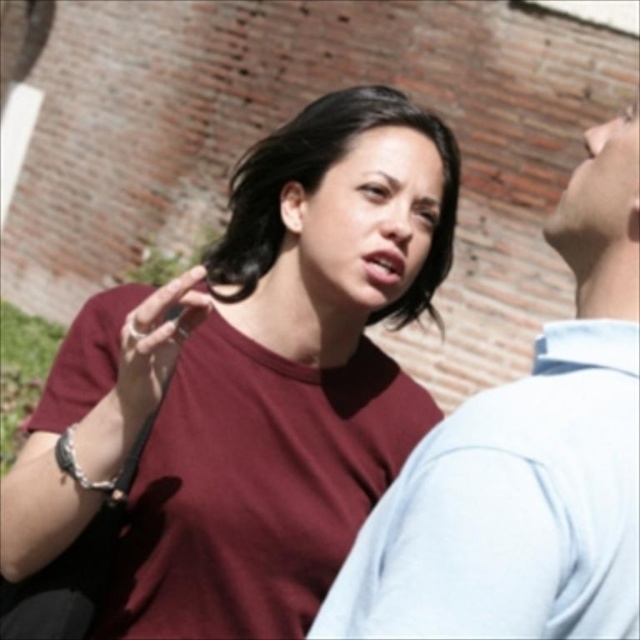
Is maroon cotton t-shirt at center to the left of light blue cotton shirt at upper right from the viewer's perspective?

Correct, you'll find maroon cotton t-shirt at center to the left of light blue cotton shirt at upper right.

Is maroon cotton t-shirt at center behind light blue cotton shirt at upper right?

Yes.

Locate an element on the screen. The image size is (640, 640). maroon cotton t-shirt at center is located at coordinates (250, 384).

Is maroon cotton t-shirt at center positioned behind matte black hand at center?

That is True.

Between maroon cotton t-shirt at center and matte black hand at center, which one has more height?

maroon cotton t-shirt at center is taller.

At what (x,y) coordinates should I click in order to perform the action: click on maroon cotton t-shirt at center. Please return your answer as a coordinate pair (x, y). Image resolution: width=640 pixels, height=640 pixels. Looking at the image, I should click on (250, 384).

At what (x,y) coordinates should I click in order to perform the action: click on maroon cotton t-shirt at center. Please return your answer as a coordinate pair (x, y). Image resolution: width=640 pixels, height=640 pixels. Looking at the image, I should click on (250, 384).

Does point (598, 253) lie in front of point (138, 387)?

That is True.

Who is positioned more to the left, light blue cotton shirt at upper right or matte black hand at center?

From the viewer's perspective, matte black hand at center appears more on the left side.

Measure the distance between light blue cotton shirt at upper right and camera.

light blue cotton shirt at upper right is 20.47 meters from camera.

Image resolution: width=640 pixels, height=640 pixels. I want to click on light blue cotton shirt at upper right, so click(525, 461).